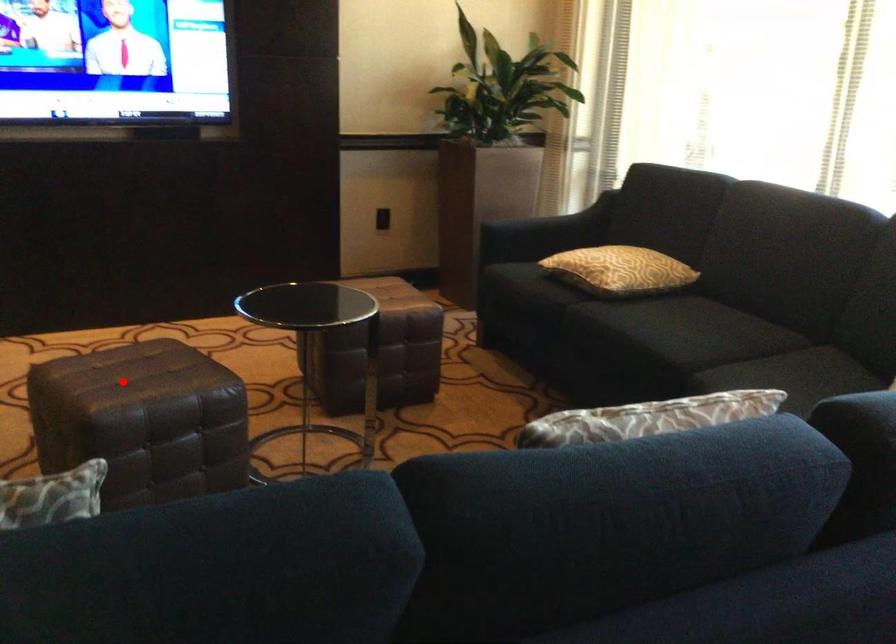
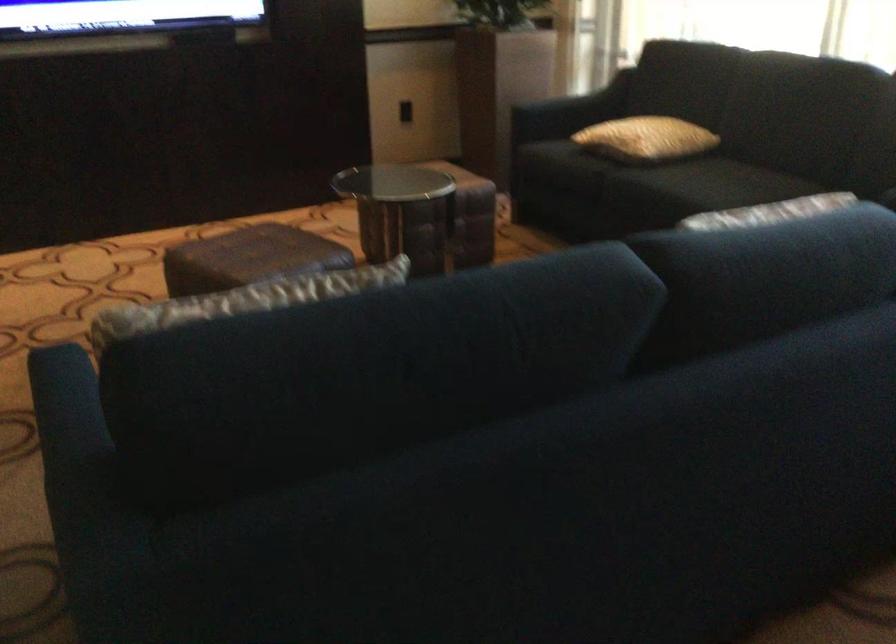
The point at the highlighted location is marked in the first image. Where is the corresponding point in the second image?

(248, 258)